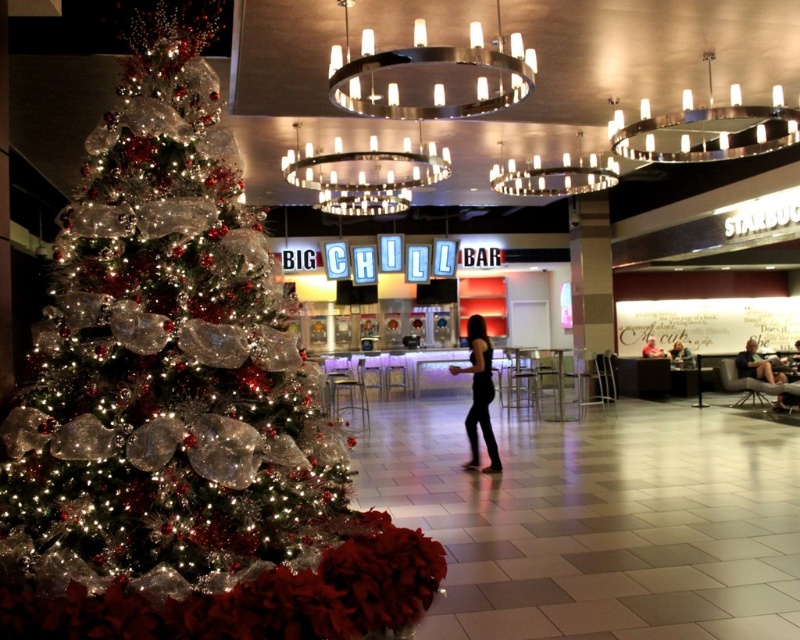
Question: Among these points, which one is nearest to the camera?

Choices:
 (A) (654, 346)
 (B) (420, 147)

Answer: (B)

Question: Can you confirm if shiny silver tree at left is thinner than black matte dress at center?

Choices:
 (A) no
 (B) yes

Answer: (A)

Question: Does shiny silver tree at left come behind metallic ring chandelier at upper center?

Choices:
 (A) yes
 (B) no

Answer: (B)

Question: Which point is closer to the camera taking this photo?

Choices:
 (A) (380, 60)
 (B) (764, 376)

Answer: (A)

Question: Which of the following is the farthest from the observer?

Choices:
 (A) (186, 241)
 (B) (686, 353)
 (C) (478, 412)
 (D) (652, 355)

Answer: (B)

Question: Is metallic ring chandelier at center above black matte dress at center?

Choices:
 (A) no
 (B) yes

Answer: (B)